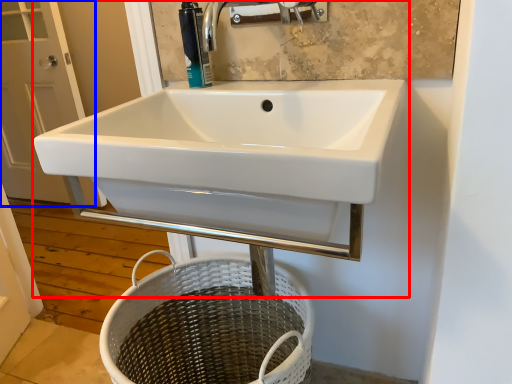
Question: Which of the following is the closest to the observer, sink (highlighted by a red box) or screen door (highlighted by a blue box)?

Choices:
 (A) sink
 (B) screen door

Answer: (A)